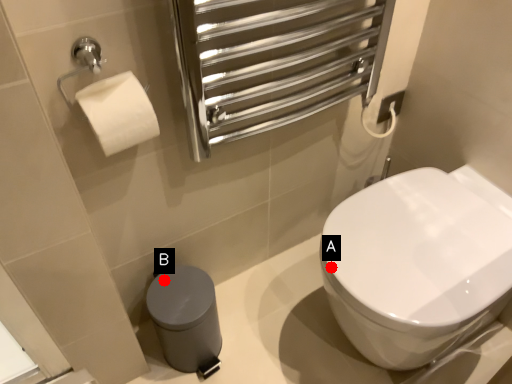
Question: Two points are circled on the image, labeled by A and B beside each circle. Which point is further to the camera?

Choices:
 (A) A is further
 (B) B is further

Answer: (B)